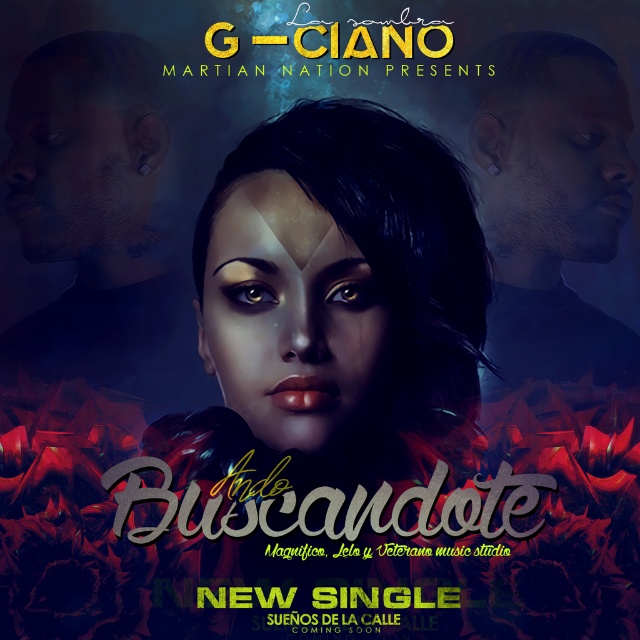
Question: Which point is closer to the camera?

Choices:
 (A) matte black face at upper right
 (B) matte black face at center

Answer: (A)

Question: From the image, what is the correct spatial relationship of matte black face at center in relation to matte black face at upper right?

Choices:
 (A) left
 (B) right

Answer: (A)

Question: Which point is closer to the camera?

Choices:
 (A) matte black face at center
 (B) matte black face at upper right

Answer: (B)

Question: Is matte black face at center in front of matte black face at upper right?

Choices:
 (A) yes
 (B) no

Answer: (B)

Question: Where is matte black face at center located in relation to matte black face at upper right in the image?

Choices:
 (A) below
 (B) above

Answer: (A)

Question: Which object is closer to the camera taking this photo?

Choices:
 (A) matte black face at center
 (B) matte black face at upper right

Answer: (B)